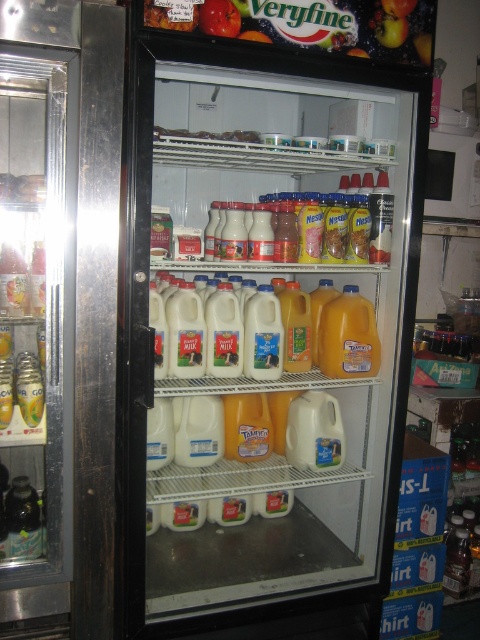
Can you confirm if white plastic milk jugs at center is positioned below translucent plastic jug at center right?

No, white plastic milk jugs at center is not below translucent plastic jug at center right.

Which of these two, white plastic milk jugs at center or translucent plastic jug at center right, stands taller?

Standing taller between the two is white plastic milk jugs at center.

The image size is (480, 640). What do you see at coordinates (262, 324) in the screenshot? I see `white plastic milk jugs at center` at bounding box center [262, 324].

Find the location of a particular element. Image resolution: width=480 pixels, height=640 pixels. white plastic milk jugs at center is located at coordinates (262, 324).